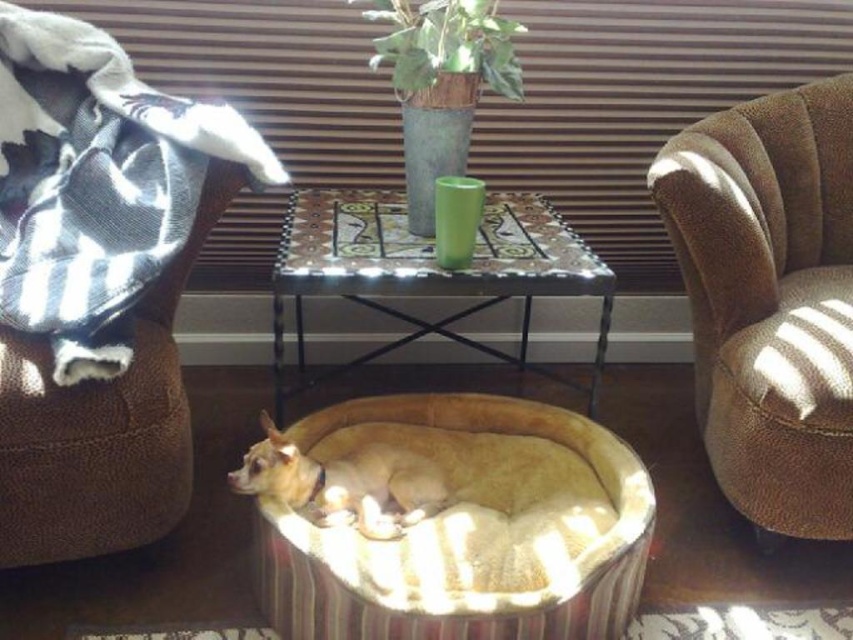
Question: Does brown textured armchair at right come in front of fuzzy beige dog at center?

Choices:
 (A) yes
 (B) no

Answer: (B)

Question: Among these objects, which one is nearest to the camera?

Choices:
 (A) brown textured armchair at right
 (B) black and white striped fabric at upper left
 (C) fuzzy beige dog at center

Answer: (B)

Question: Which of these objects is positioned closest to the brown textured armchair at right?

Choices:
 (A) black and white striped fabric at upper left
 (B) fuzzy beige dog at center
 (C) velvet beige dog bed at center

Answer: (C)

Question: Can you confirm if brown textured armchair at right is positioned to the left of black and white striped fabric at upper left?

Choices:
 (A) no
 (B) yes

Answer: (A)

Question: Among these points, which one is nearest to the camera?

Choices:
 (A) (33, 244)
 (B) (833, 406)

Answer: (B)

Question: Can you confirm if velvet beige dog bed at center is bigger than black and white striped fabric at upper left?

Choices:
 (A) no
 (B) yes

Answer: (A)